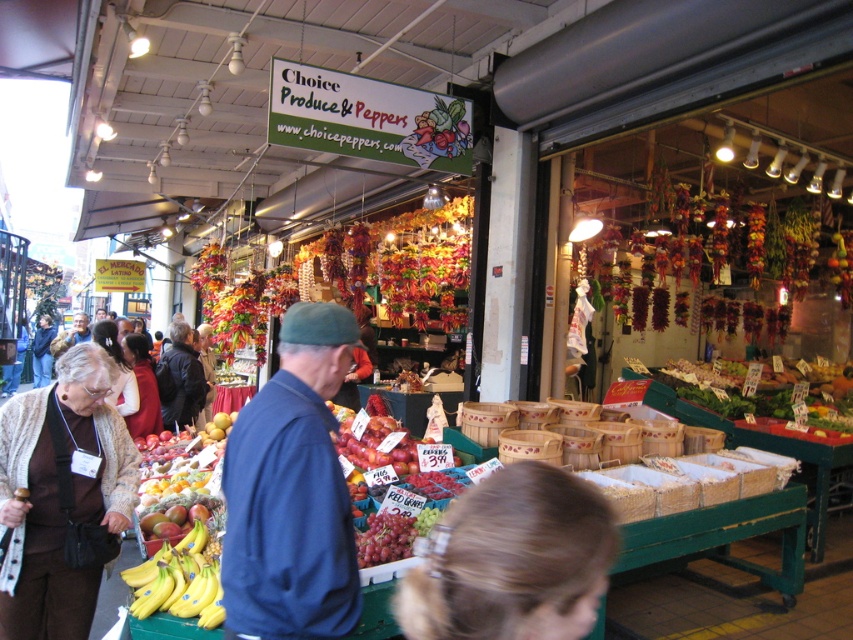
Question: Based on their relative distances, which object is farther from the matte red sweater at center?

Choices:
 (A) beige wool cardigan at lower left
 (B) blue fabric jacket at center
 (C) blonde hair at lower center
 (D) blue denim jacket at center

Answer: (D)

Question: Does blue fabric jacket at center have a larger size compared to beige wool cardigan at lower left?

Choices:
 (A) yes
 (B) no

Answer: (B)

Question: Can you confirm if beige wool cardigan at lower left is positioned above dark blue jacket at center?

Choices:
 (A) yes
 (B) no

Answer: (B)

Question: Which object appears farthest from the camera in this image?

Choices:
 (A) matte red sweater at center
 (B) dark blue jacket at center
 (C) blue denim jacket at center
 (D) blue fabric jacket at center

Answer: (C)

Question: Based on their relative distances, which object is farther from the blonde hair at lower center?

Choices:
 (A) dark blue jacket at center
 (B) blue denim jacket at center
 (C) white fabric jacket at lower left
 (D) blue fabric jacket at center

Answer: (C)

Question: Does beige wool cardigan at lower left appear under blue denim jacket at center?

Choices:
 (A) no
 (B) yes

Answer: (B)